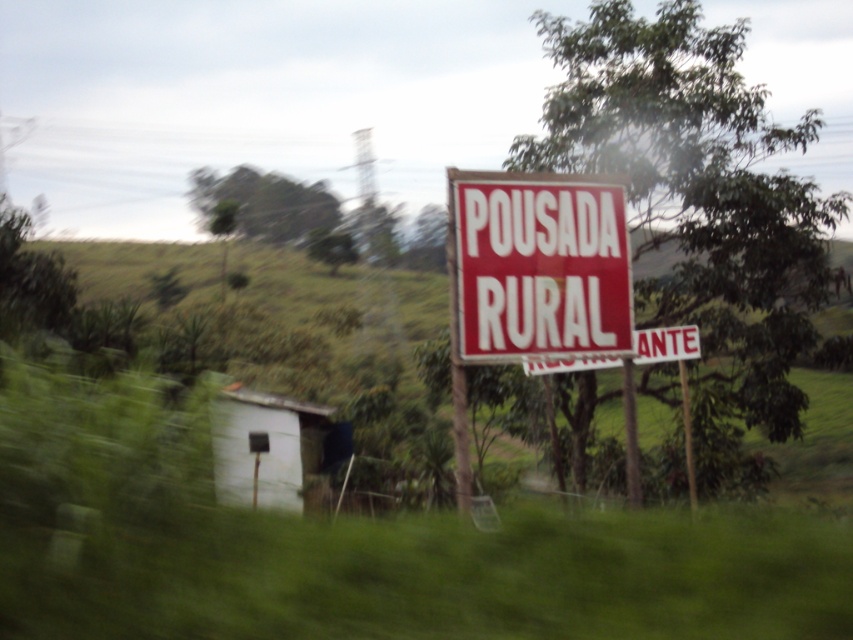
Is red matte sign at center further to camera compared to white matte hut at lower left?

Yes, it is.

Which is behind, point (561, 182) or point (241, 452)?

Positioned behind is point (241, 452).

Find the location of `red matte sign at center`. red matte sign at center is located at coordinates (538, 266).

Between green leafy tree at upper right and red matte sign at center, which one appears on the right side from the viewer's perspective?

green leafy tree at upper right is more to the right.

Does green leafy tree at upper right come in front of red matte sign at center?

No, it is not.

Between point (692, 16) and point (473, 186), which one is positioned behind?

Point (692, 16)

I want to click on green leafy tree at upper right, so click(695, 173).

Can you confirm if green leafy tree at upper right is shorter than white matte hut at lower left?

In fact, green leafy tree at upper right may be taller than white matte hut at lower left.

Describe the element at coordinates (695, 173) in the screenshot. This screenshot has width=853, height=640. I see `green leafy tree at upper right` at that location.

Identify the location of green leafy tree at upper right. (695, 173).